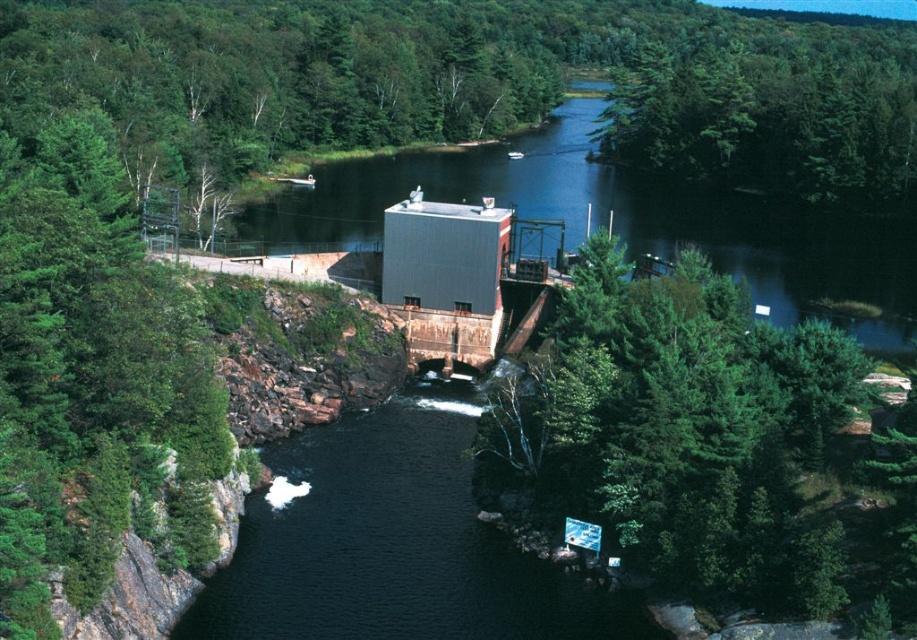
You are standing at the dam and want to reach the point marked at coordinates point (862, 248). If your walking speed is 3 feet per second, how long will it take you to reach that point?

The point (862, 248) is 484.56 feet away from the viewer. At a walking speed of 3 feet per second, it would take approximately 161.52 seconds to reach the point.

You are standing at the dam and want to place a small solar panel. You have two points marked on the map where you can install it. The first point is at coordinate point (547, 179) and the second is at point (741, 61). Which point is closer to you so that the solar panel can get more sunlight?

Point (547, 179) is closer to the viewer than point (741, 61), so placing the solar panel there would be closer and potentially receive more sunlight depending on the angle.